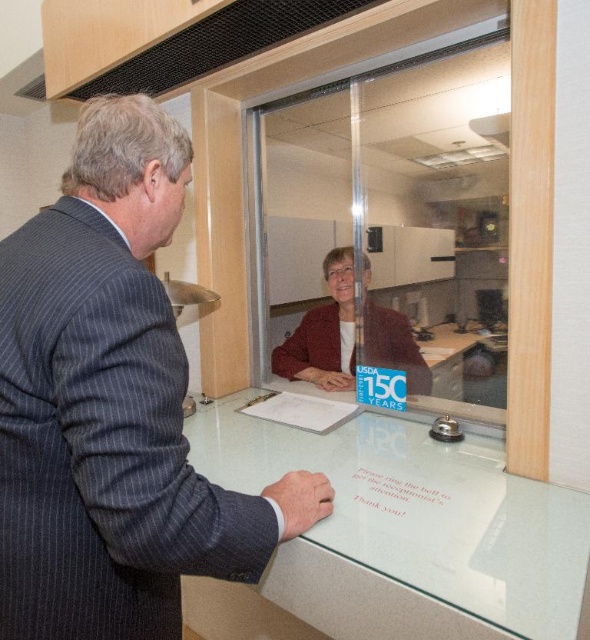
You are an assistant who needs to arrange two suits in a display case. The display case has a height limit of 1.5 meters. The dark gray pinstripe suit at center and the matte black suit at center are both available. Which suit will fit within the height limit?

The dark gray pinstripe suit at center is taller than the matte black suit at center. Therefore, the matte black suit at center will fit within the 1.5 meter height limit if the dark gray pinstripe suit at center exceeds it.

You are standing in the office and want to approach the dark gray pinstripe suit at center and the matte black suit at center. Which one will you reach first?

You will reach the dark gray pinstripe suit at center first because it is closer to you than the matte black suit at center.

You are standing in the office and want to place a small plant on the clear glass table at center. The table has a coordinate system where the bottom left corner is the origin. The point you want to place the plant at is given as point (x=396, y=536). Is this point on the clear glass table at center?

Yes, the point (x=396, y=536) is on the clear glass table at center according to the provided coordinates.